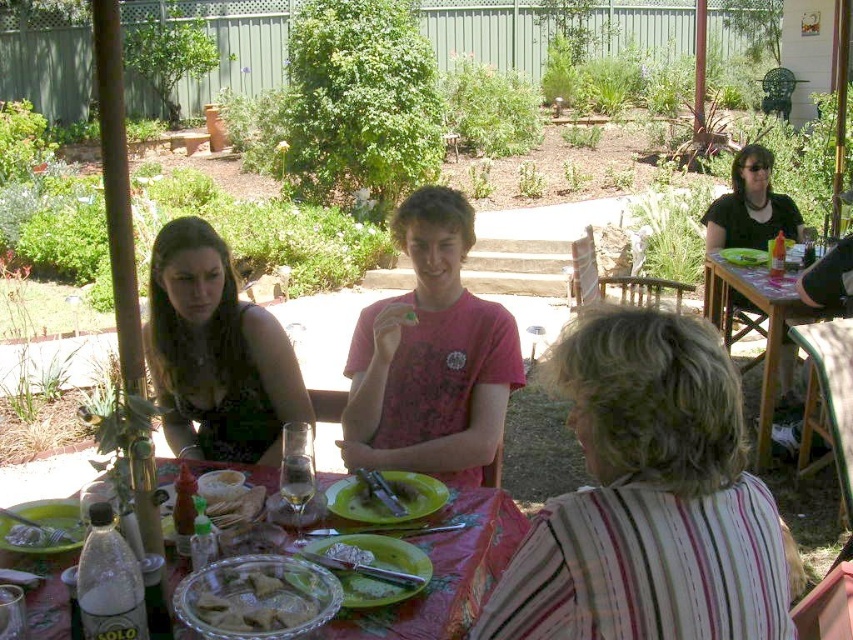
Question: Does translucent glass plate at lower center have a smaller size compared to golden brown pastry at center?

Choices:
 (A) yes
 (B) no

Answer: (B)

Question: Which is farther from the golden brown pastry at center?

Choices:
 (A) white creamy cheese at center
 (B) translucent glass plate at lower center

Answer: (B)

Question: Considering the relative positions of white striped shirt at lower right and translucent glass plate at lower center in the image provided, where is white striped shirt at lower right located with respect to translucent glass plate at lower center?

Choices:
 (A) right
 (B) left

Answer: (A)

Question: From the image, what is the correct spatial relationship of golden brown pastry at center in relation to green leafy salad at center?

Choices:
 (A) below
 (B) above

Answer: (A)

Question: Which object is farther from the camera taking this photo?

Choices:
 (A) matte black dress at center
 (B) white striped shirt at lower right
 (C) pink cotton t-shirt at center

Answer: (A)

Question: Which point appears farthest from the camera in this image?

Choices:
 (A) (409, 294)
 (B) (668, 384)

Answer: (A)